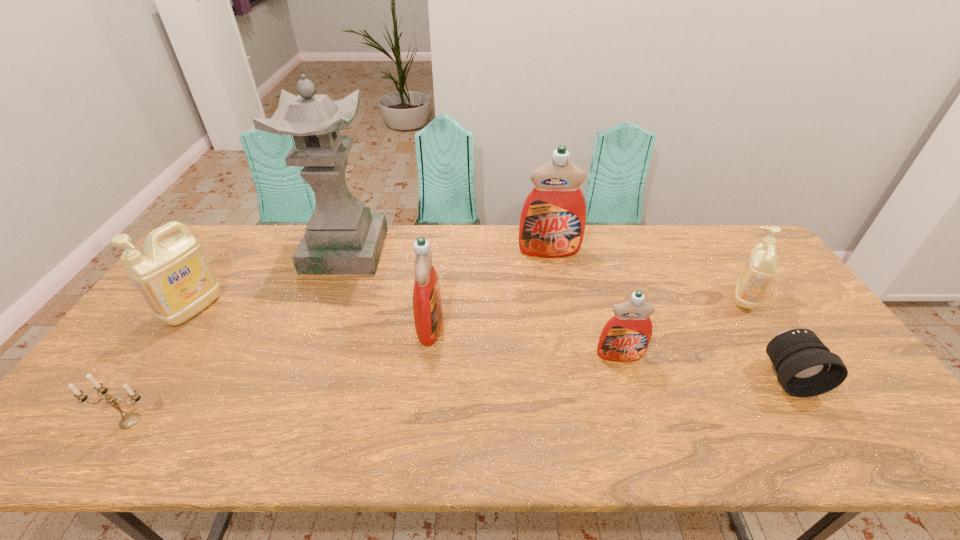
Find the location of a particular element. The width and height of the screenshot is (960, 540). unoccupied area between the biggest red detergent and the gray sculpture is located at coordinates [x=447, y=251].

Image resolution: width=960 pixels, height=540 pixels. I want to click on free space between the leftmost detergent and the seventh tallest object, so click(162, 365).

Find the location of a particular element. The width and height of the screenshot is (960, 540). free space that is in between the sculpture and the fifth object from right to left is located at coordinates (388, 288).

Where is `vacant space that is in between the tallest object and the smallest red detergent`? The height and width of the screenshot is (540, 960). vacant space that is in between the tallest object and the smallest red detergent is located at coordinates (483, 303).

Where is `free spot between the shortest object and the smallest red detergent`? Image resolution: width=960 pixels, height=540 pixels. free spot between the shortest object and the smallest red detergent is located at coordinates (705, 366).

Locate which object is the fourth closest to the smaller beige detergent. Please provide its 2D coordinates. Your answer should be formatted as a tuple, i.e. [(x, y)], where the tuple contains the x and y coordinates of a point satisfying the conditions above.

[(427, 305)]

Identify which object is located as the nearest to the farthest red detergent. Please provide its 2D coordinates. Your answer should be formatted as a tuple, i.e. [(x, y)], where the tuple contains the x and y coordinates of a point satisfying the conditions above.

[(427, 305)]

Image resolution: width=960 pixels, height=540 pixels. I want to click on detergent that is the second nearest to the rightmost detergent, so click(x=552, y=223).

Where is `detergent that is the fourth closest one to the tallest object`? The height and width of the screenshot is (540, 960). detergent that is the fourth closest one to the tallest object is located at coordinates (626, 336).

Identify which red detergent is located as the second nearest to the smallest red detergent. Please provide its 2D coordinates. Your answer should be formatted as a tuple, i.e. [(x, y)], where the tuple contains the x and y coordinates of a point satisfying the conditions above.

[(427, 305)]